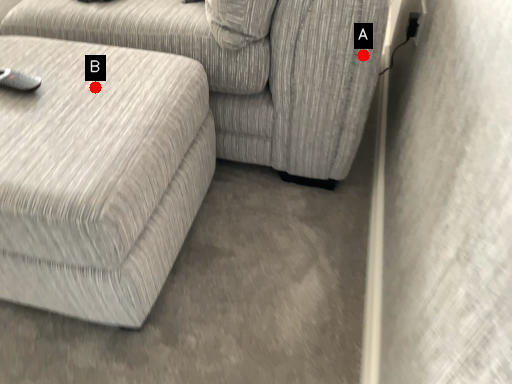
Question: Two points are circled on the image, labeled by A and B beside each circle. Which point is further to the camera?

Choices:
 (A) A is further
 (B) B is further

Answer: (A)